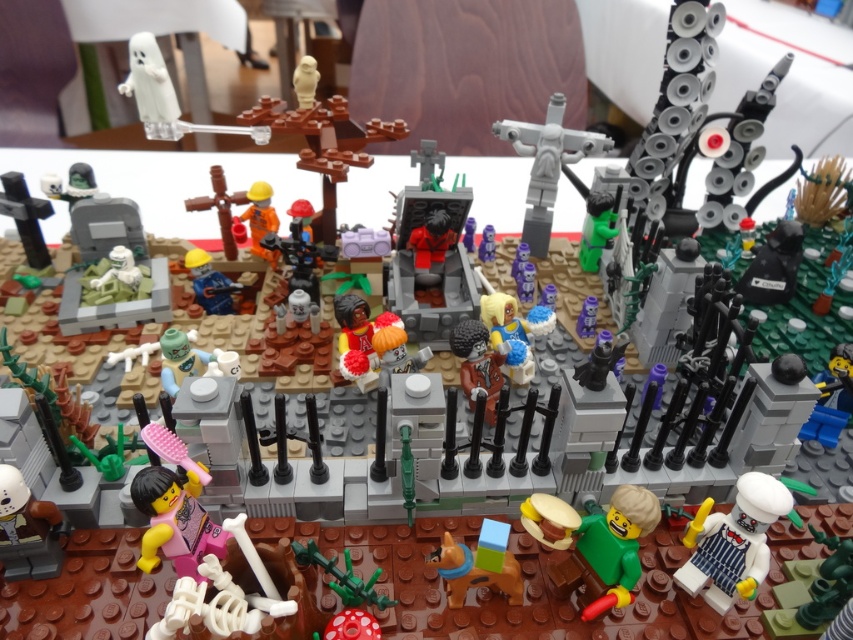
Question: From the image, what is the correct spatial relationship of white glossy chef hat at lower right in relation to white matte ghost at upper left?

Choices:
 (A) above
 (B) below

Answer: (B)

Question: Is shiny red suit at center in front of blue plastic construction worker at center?

Choices:
 (A) no
 (B) yes

Answer: (B)

Question: Which object is farther from the camera taking this photo?

Choices:
 (A) white matte ghost at upper left
 (B) blue plastic construction worker at center

Answer: (B)

Question: Which of the following is the farthest from the observer?

Choices:
 (A) (215, 301)
 (B) (311, 554)

Answer: (A)

Question: Which object is closer to the camera taking this photo?

Choices:
 (A) white glossy chef hat at lower right
 (B) brown matte horse at center
 (C) blue plastic construction worker at center

Answer: (A)

Question: Does gray plastic crucifix at center appear under green matte plant at center?

Choices:
 (A) no
 (B) yes

Answer: (A)